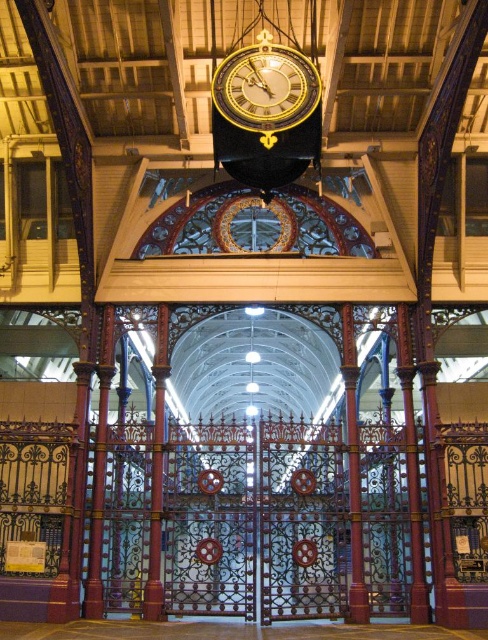
Is metallic wrought iron gate at lower center positioned at the back of gold metallic clock at center?

Yes, it is behind gold metallic clock at center.

In order to click on metallic wrought iron gate at lower center in this screenshot , I will do `click(248, 518)`.